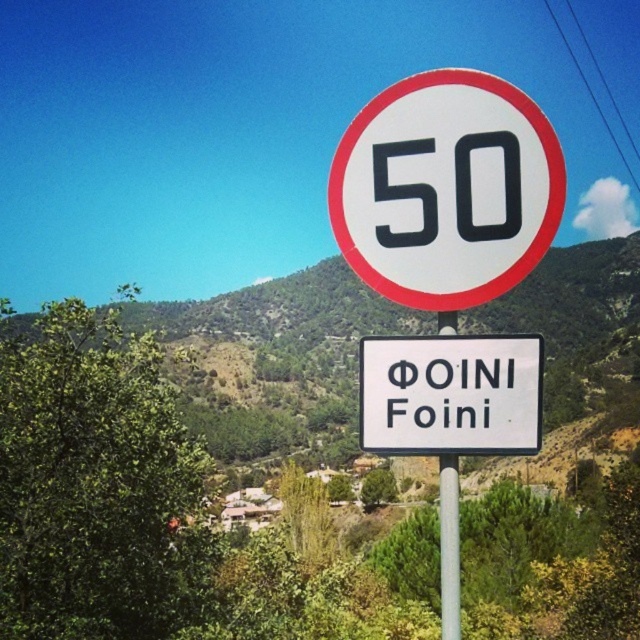
Question: Which point appears closest to the camera in this image?

Choices:
 (A) (420, 419)
 (B) (454, 328)

Answer: (A)

Question: Is white plastic sign at center to the right of silver metallic pole at center from the viewer's perspective?

Choices:
 (A) yes
 (B) no

Answer: (B)

Question: Can you confirm if white plastic sign at center is wider than silver metallic pole at center?

Choices:
 (A) no
 (B) yes

Answer: (A)

Question: Considering the relative positions of white plastic sign at center and silver metallic pole at center in the image provided, where is white plastic sign at center located with respect to silver metallic pole at center?

Choices:
 (A) above
 (B) below

Answer: (A)